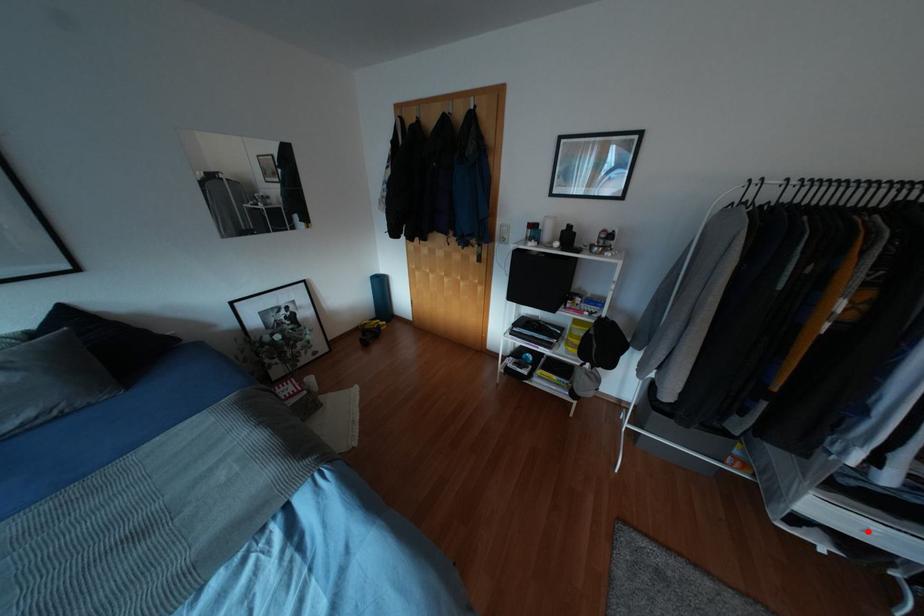
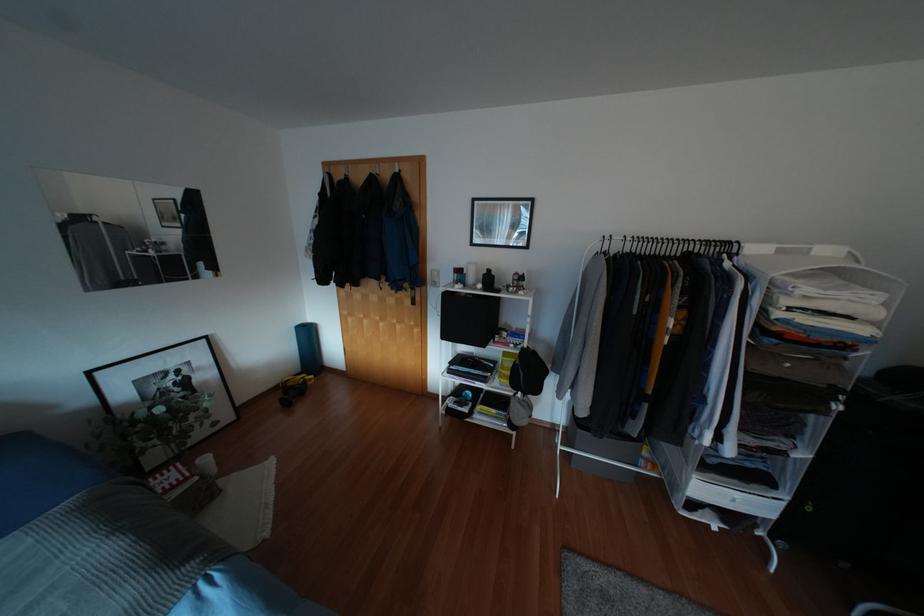
Find the pixel in the second image that matches the highlighted location in the first image.

(734, 500)